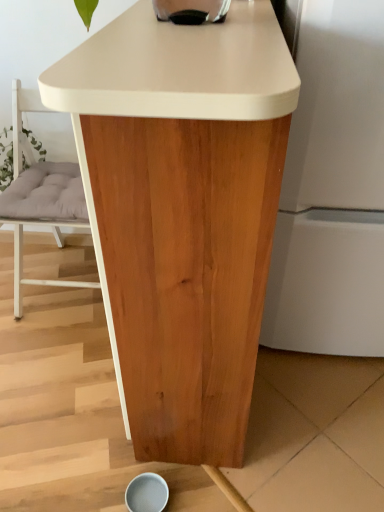
Question: Is light gray cushioned chair at center surrounding natural wood table at center?

Choices:
 (A) no
 (B) yes

Answer: (A)

Question: Does light gray cushioned chair at center have a smaller size compared to natural wood table at center?

Choices:
 (A) yes
 (B) no

Answer: (A)

Question: Considering the relative sizes of light gray cushioned chair at center and natural wood table at center in the image provided, is light gray cushioned chair at center taller than natural wood table at center?

Choices:
 (A) yes
 (B) no

Answer: (B)

Question: Does light gray cushioned chair at center lie in front of natural wood table at center?

Choices:
 (A) no
 (B) yes

Answer: (A)

Question: Considering the relative sizes of light gray cushioned chair at center and natural wood table at center in the image provided, is light gray cushioned chair at center bigger than natural wood table at center?

Choices:
 (A) no
 (B) yes

Answer: (A)

Question: Considering the relative positions of light gray cushioned chair at center and natural wood table at center in the image provided, is light gray cushioned chair at center behind natural wood table at center?

Choices:
 (A) yes
 (B) no

Answer: (A)

Question: Does natural wood table at center contain light gray cushioned chair at center?

Choices:
 (A) yes
 (B) no

Answer: (B)

Question: Does natural wood table at center have a smaller size compared to light gray cushioned chair at center?

Choices:
 (A) yes
 (B) no

Answer: (B)

Question: From a real-world perspective, does natural wood table at center sit lower than light gray cushioned chair at center?

Choices:
 (A) no
 (B) yes

Answer: (A)

Question: Considering the relative positions of natural wood table at center and light gray cushioned chair at center in the image provided, is natural wood table at center in front of light gray cushioned chair at center?

Choices:
 (A) no
 (B) yes

Answer: (B)

Question: Can you confirm if natural wood table at center is shorter than light gray cushioned chair at center?

Choices:
 (A) yes
 (B) no

Answer: (B)

Question: From the image's perspective, is natural wood table at center below light gray cushioned chair at center?

Choices:
 (A) yes
 (B) no

Answer: (A)

Question: Based on their positions, is light gray cushioned chair at center located to the left or right of natural wood table at center?

Choices:
 (A) right
 (B) left

Answer: (B)